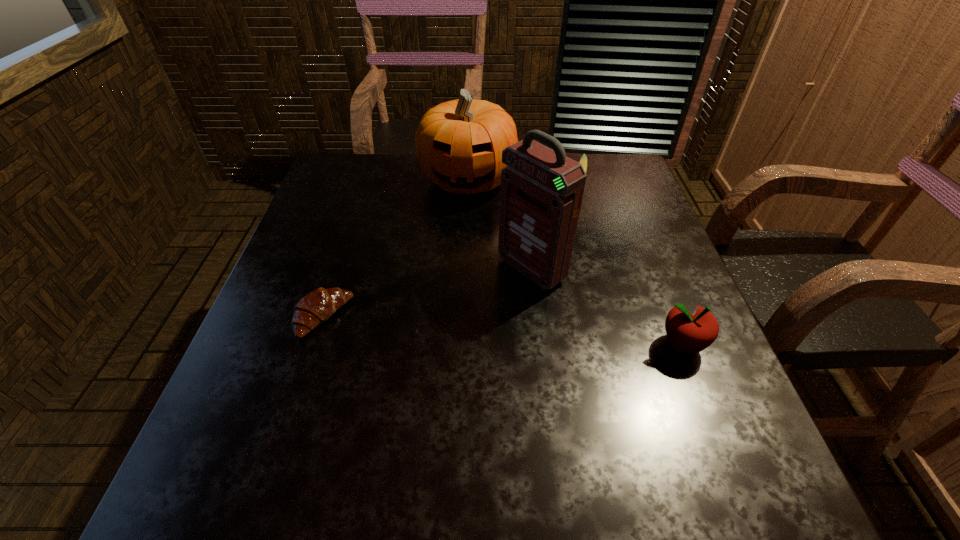
Where is `vacant region that satisfies the following two spatial constraints: 1. on the front side of the tallest object; 2. on the left side of the pumpkin`? vacant region that satisfies the following two spatial constraints: 1. on the front side of the tallest object; 2. on the left side of the pumpkin is located at coordinates (464, 269).

Locate an element on the screen. free spot that satisfies the following two spatial constraints: 1. on the back side of the second shortest object; 2. on the right side of the shortest object is located at coordinates (368, 182).